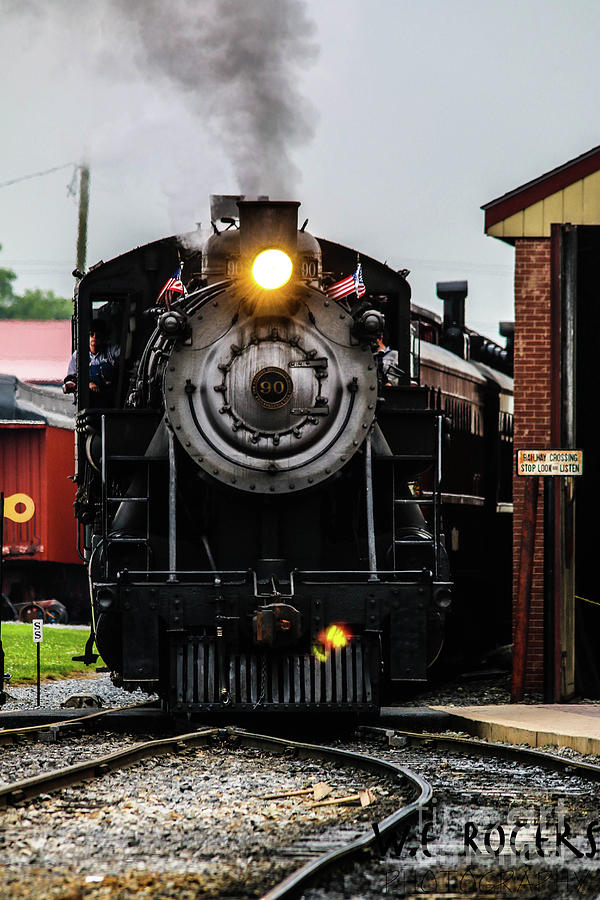
Image resolution: width=600 pixels, height=900 pixels. I want to click on handrail, so click(x=209, y=443).